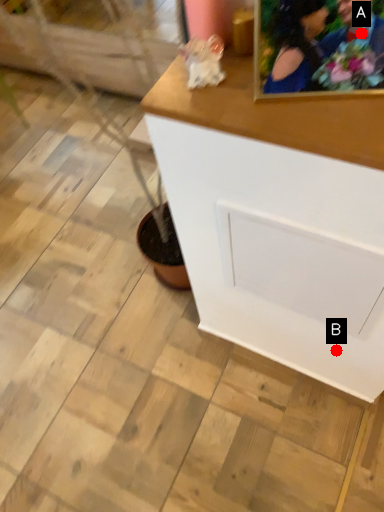
Question: Two points are circled on the image, labeled by A and B beside each circle. Which point is farther to the camera?

Choices:
 (A) A is further
 (B) B is further

Answer: (B)